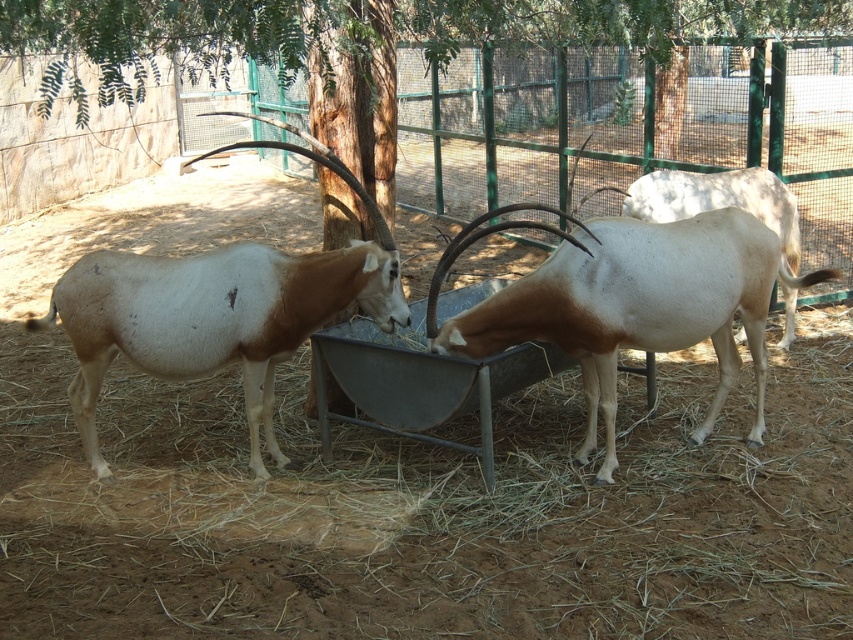
Is brown and white antelope at left taller than white glossy antelope at center?

Yes.

Who is higher up, brown and white antelope at left or white glossy antelope at center?

white glossy antelope at center

Describe the element at coordinates (218, 308) in the screenshot. Image resolution: width=853 pixels, height=640 pixels. I see `brown and white antelope at left` at that location.

The height and width of the screenshot is (640, 853). Find the location of `brown and white antelope at left`. brown and white antelope at left is located at coordinates (218, 308).